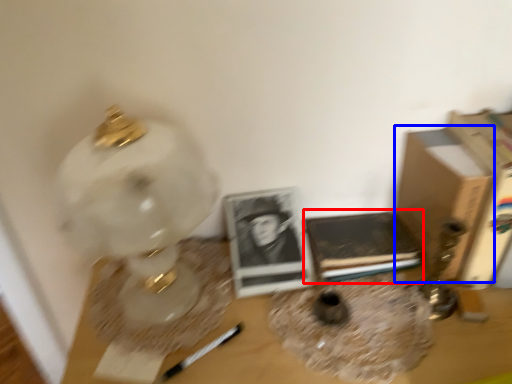
Question: Which point is further to the camera, paperback book (highlighted by a red box) or cardboard box (highlighted by a blue box)?

Choices:
 (A) paperback book
 (B) cardboard box

Answer: (A)